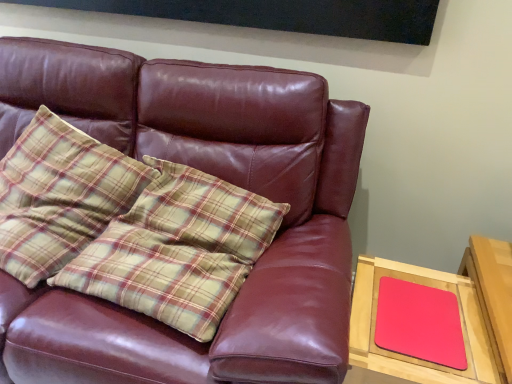
Measure the distance between point [504,264] and camera.

The depth of point [504,264] is 1.22 meters.

Describe the element at coordinates (60, 195) in the screenshot. I see `plaid fabric pillow at left` at that location.

Locate an element on the screen. Image resolution: width=512 pixels, height=384 pixels. matte pink mousepad at right is located at coordinates (419, 323).

Based on their sizes in the image, would you say matte leather couch at center is bigger or smaller than plaid fabric pillow at left?

matte leather couch at center is bigger than plaid fabric pillow at left.

Which of these two, matte leather couch at center or plaid fabric pillow at left, is thinner?

plaid fabric pillow at left.

Can plaid fabric pillow at left be found inside matte leather couch at center?

Yes, plaid fabric pillow at left is surrounded by matte leather couch at center.

Would you consider matte leather couch at center to be distant from plaid fabric pillow at left?

matte leather couch at center is actually quite close to plaid fabric pillow at left.

Could you tell me if matte leather couch at center is turned towards matte pink mousepad at right?

No, matte leather couch at center is not facing towards matte pink mousepad at right.

From a real-world perspective, is matte leather couch at center physically below matte pink mousepad at right?

No, from a real-world perspective, matte leather couch at center is not below matte pink mousepad at right.

Where is `studio couch that is on the left side of matte pink mousepad at right`? This screenshot has height=384, width=512. studio couch that is on the left side of matte pink mousepad at right is located at coordinates (211, 174).

Which is less distant, (396, 281) or (256, 141)?

Point (396, 281).

From a real-world perspective, is matte pink mousepad at right positioned over matte leather couch at center based on gravity?

No.

Where is `pad that is on the right side of matte leather couch at center`? pad that is on the right side of matte leather couch at center is located at coordinates (419, 323).

Does matte pink mousepad at right lie in front of matte leather couch at center?

No.

Consider the image. From the image's perspective, which is above, matte pink mousepad at right or plaid fabric pillow at left?

plaid fabric pillow at left, from the image's perspective.

Is matte pink mousepad at right next to plaid fabric pillow at left?

No, matte pink mousepad at right is not beside plaid fabric pillow at left.

From a real-world perspective, relative to plaid fabric pillow at left, is matte pink mousepad at right vertically above or below?

From a real-world perspective, matte pink mousepad at right is physically below plaid fabric pillow at left.

Which of these two, matte pink mousepad at right or plaid fabric pillow at left, stands taller?

Standing taller between the two is plaid fabric pillow at left.

Is matte pink mousepad at right at the left side of matte pink mousepad at right?

In fact, matte pink mousepad at right is to the right of matte pink mousepad at right.

Is matte pink mousepad at right smaller than matte pink mousepad at right?

Correct, matte pink mousepad at right occupies less space than matte pink mousepad at right.

Is there a large distance between matte pink mousepad at right and matte pink mousepad at right?

Actually, matte pink mousepad at right and matte pink mousepad at right are a little close together.

Is matte pink mousepad at right oriented towards matte pink mousepad at right?

Yes, matte pink mousepad at right faces towards matte pink mousepad at right.

Is matte leather couch at center completely or partially inside plaid fabric pillow at left?

No, matte leather couch at center is located outside of plaid fabric pillow at left.

From a real-world perspective, is plaid fabric pillow at left over matte leather couch at center?

Indeed, from a real-world perspective, plaid fabric pillow at left stands above matte leather couch at center.

Who is more distant, plaid fabric pillow at left or matte leather couch at center?

plaid fabric pillow at left is more distant.

From the image's perspective, which is below, plaid fabric pillow at left or matte leather couch at center?

matte leather couch at center is shown below in the image.

Does matte pink mousepad at right have a greater width compared to plaid fabric pillow at left?

A: Incorrect, the width of matte pink mousepad at right does not surpass that of plaid fabric pillow at left.

Which of these two, matte pink mousepad at right or plaid fabric pillow at left, is bigger?

With larger size is plaid fabric pillow at left.

How much distance is there between matte pink mousepad at right and plaid fabric pillow at left?

matte pink mousepad at right is 38.76 inches away from plaid fabric pillow at left.

Considering their positions, is matte pink mousepad at right located in front of or behind plaid fabric pillow at left?

Visually, matte pink mousepad at right is located behind plaid fabric pillow at left.

Identify the location of studio couch that is in front of the plaid fabric pillow at left. The width and height of the screenshot is (512, 384). (211, 174).

At what (x,y) coordinates should I click in order to perform the action: click on table behind the matte leather couch at center. Please return your answer as a coordinate pair (x, y). This screenshot has width=512, height=384. Looking at the image, I should click on (452, 311).

From the image, which object appears to be farther from matte leather couch at center, plaid fabric pillow at left or matte pink mousepad at right?

matte pink mousepad at right.

When comparing their distances from plaid fabric pillow at left, does matte pink mousepad at right or matte pink mousepad at right seem closer?

matte pink mousepad at right.

Based on the photo, considering their positions, is matte pink mousepad at right positioned closer to matte leather couch at center than matte pink mousepad at right?

→ matte pink mousepad at right is closer to matte leather couch at center.

From the picture: Based on their spatial positions, is matte pink mousepad at right or matte pink mousepad at right further from matte leather couch at center?

matte pink mousepad at right.

Looking at the image, which one is located closer to plaid fabric pillow at left, matte leather couch at center or matte pink mousepad at right?

matte leather couch at center lies closer to plaid fabric pillow at left than the other object.

Considering their positions, is matte pink mousepad at right positioned closer to matte pink mousepad at right than matte leather couch at center?

matte pink mousepad at right.

Which object lies further to the anchor point matte pink mousepad at right, matte pink mousepad at right or plaid fabric pillow at left?

plaid fabric pillow at left lies further to matte pink mousepad at right than the other object.

Which object lies nearer to the anchor point plaid fabric pillow at left, matte pink mousepad at right or matte leather couch at center?

matte leather couch at center is closer to plaid fabric pillow at left.

Where is `table located between matte leather couch at center and matte pink mousepad at right in the left-right direction`? This screenshot has width=512, height=384. table located between matte leather couch at center and matte pink mousepad at right in the left-right direction is located at coordinates (452, 311).

Where is `table between plaid fabric pillow at left and matte pink mousepad at right in the horizontal direction`? Image resolution: width=512 pixels, height=384 pixels. table between plaid fabric pillow at left and matte pink mousepad at right in the horizontal direction is located at coordinates (452, 311).

You are a GUI agent. You are given a task and a screenshot of the screen. Output one action in this format:
    pyautogui.click(x=<x>, y=<y>)
    Task: Click on the studio couch situated between plaid fabric pillow at left and matte pink mousepad at right from left to right
    
    Given the screenshot: What is the action you would take?
    pyautogui.click(x=211, y=174)

Locate an element on the screen. studio couch between plaid fabric pillow at left and matte pink mousepad at right is located at coordinates (211, 174).